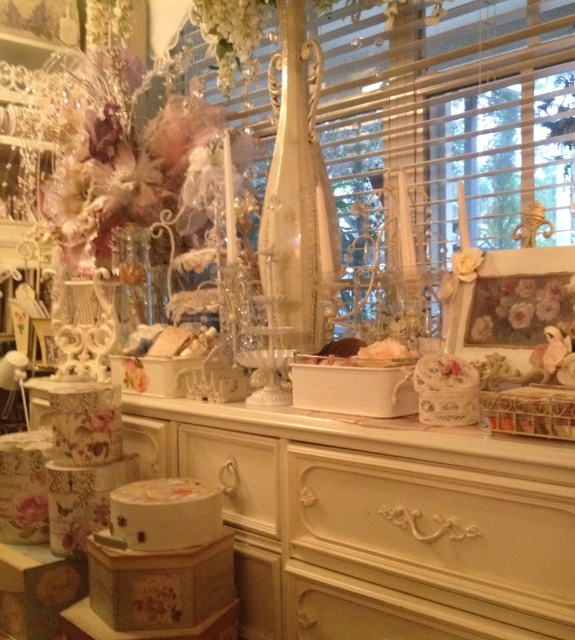
Question: Does floral-patterned wood vanity at lower left appear under white wood drawer at center?

Choices:
 (A) yes
 (B) no

Answer: (A)

Question: Which object is farther from the camera taking this photo?

Choices:
 (A) metallic gold vase at center
 (B) floral-patterned wood vanity at lower left
 (C) white carved drawer at center

Answer: (A)

Question: Considering the real-world distances, which object is farthest from the floral-patterned fabric at lower left?

Choices:
 (A) metallic gold vase at center
 (B) floral fabric cushion at center
 (C) white wood drawer at center

Answer: (A)

Question: Does white wood drawer at center have a smaller size compared to floral fabric cushion at center?

Choices:
 (A) no
 (B) yes

Answer: (A)

Question: Based on their relative distances, which object is farther from the metallic gold vase at center?

Choices:
 (A) white wood drawer at center
 (B) floral-patterned fabric at lower left

Answer: (B)

Question: Does white carved drawer at center appear on the left side of white wood drawer at center?

Choices:
 (A) no
 (B) yes

Answer: (A)